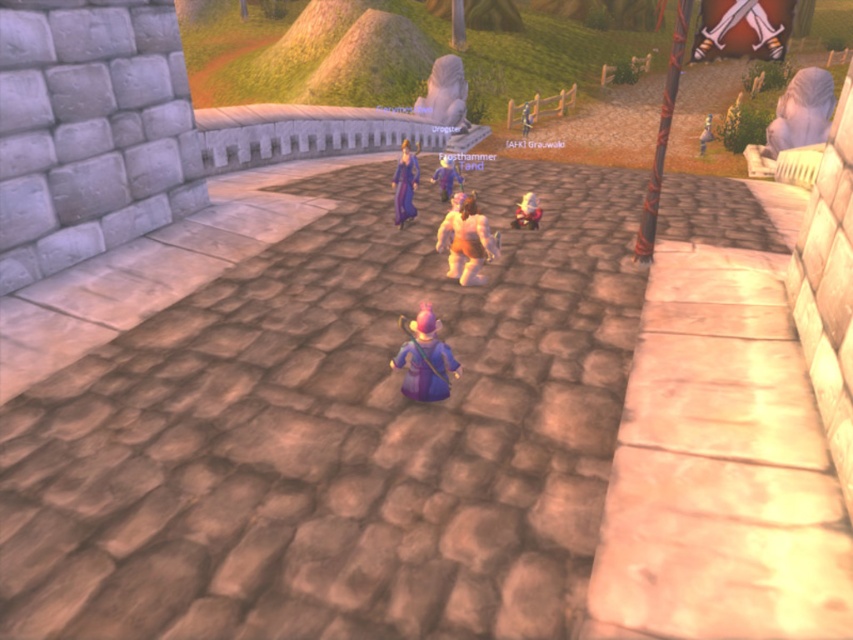
You are controlling the purple robed character on the cobblestone path. There are two points marked on the map. The first point is at coordinate (448, 243) and the second point is at (532, 228). Which point should you move towards first if you want to reach the second point after the first?

You should move towards point (448, 243) first because it is in front of point (532, 228). This way, you can reach the second point after the first in the correct order.